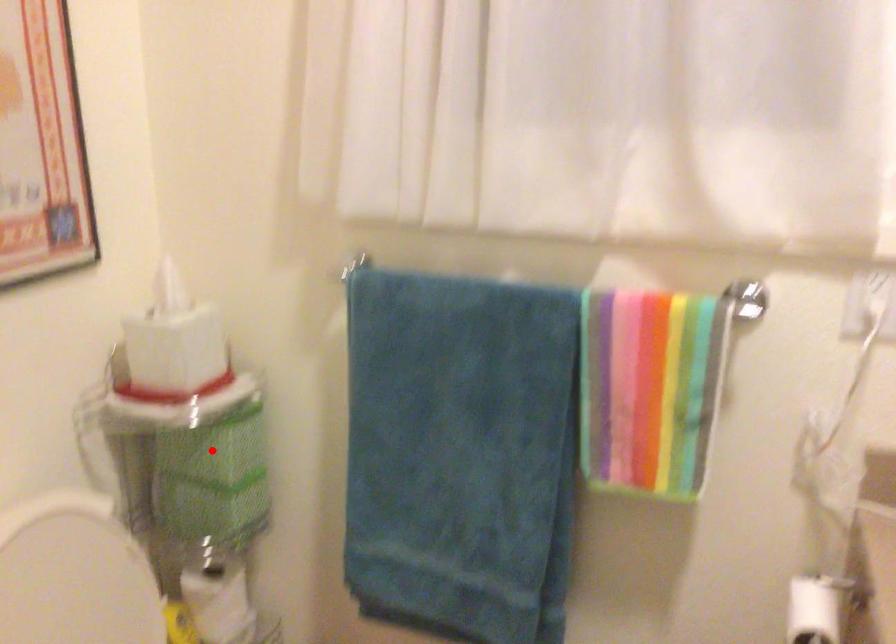
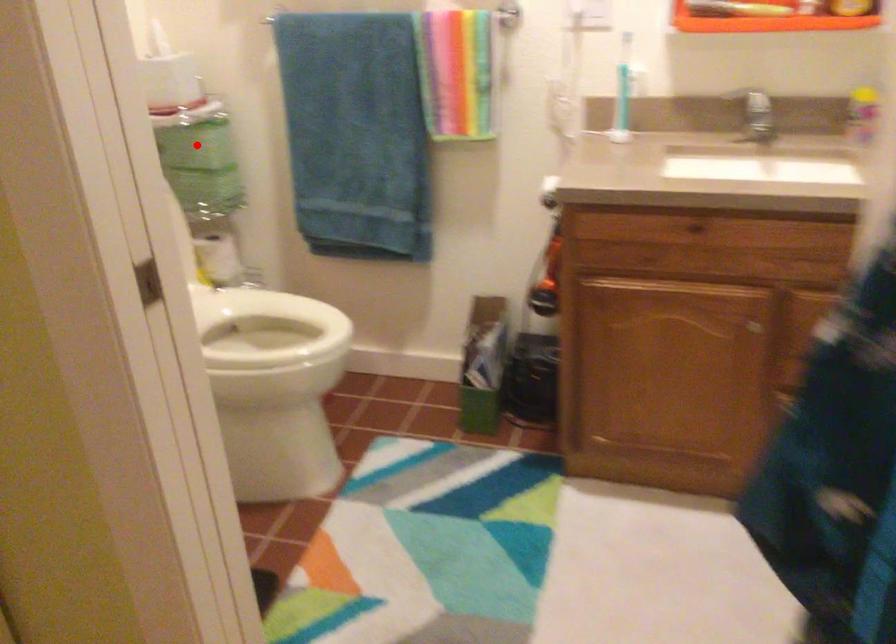
I am providing you with two images of the same scene from different viewpoints. A red point is marked on the first image and another point is marked on the second image. Is the red point in image1 aligned with the point shown in image2?

Yes